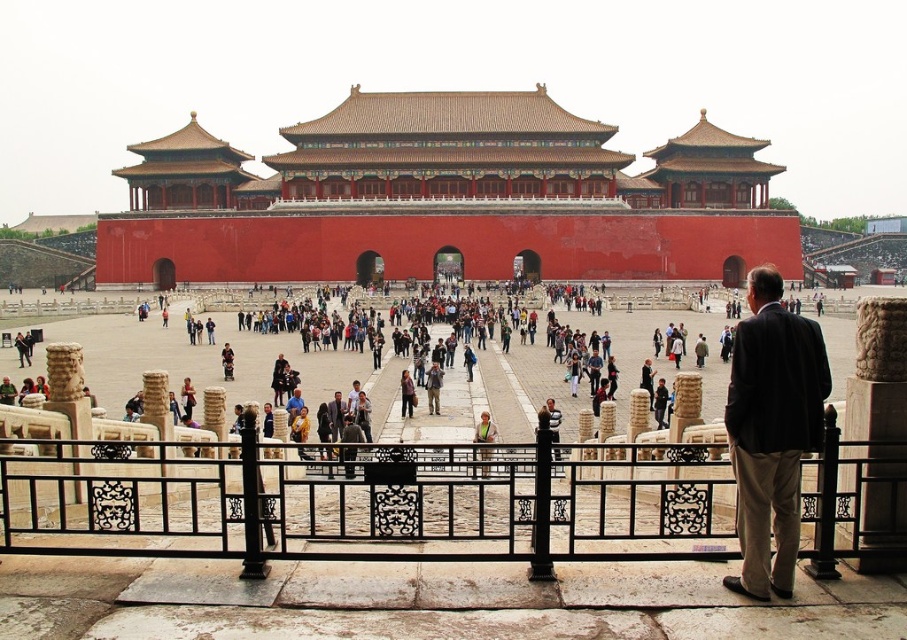
You are a tourist in the Forbidden City and want to take a photo of the black wrought iron fence at center without any people blocking it. Since the dark brown leather jacket at center is in the way, can you move to the side to capture the entire fence? Explain why based on their widths.

The black wrought iron fence at center is wider than the dark brown leather jacket at center. Since the fence is wider, moving to the side should allow you to capture the entire fence without the jacket blocking it, as the jacket is narrower and might be positioned within the fence area.

You are a tourist standing in the courtyard of the Forbidden City. You see a black wrought iron fence at center and a dark brown suit at center. Which object is positioned to the right side of the other?

The black wrought iron fence at center is to the left of the dark brown suit at center, so the dark brown suit at center is positioned to the right side of the black wrought iron fence at center.